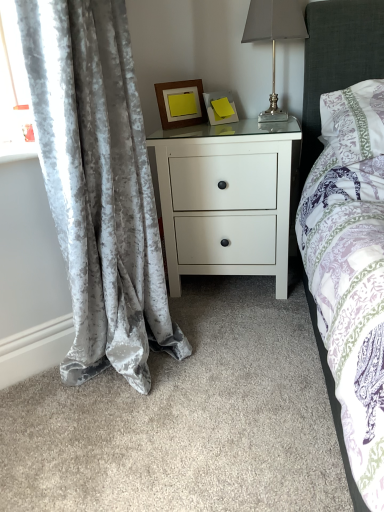
What do you see at coordinates (99, 185) in the screenshot? The image size is (384, 512). I see `velvet gray curtain at left` at bounding box center [99, 185].

Where is `matte yellow picture frame at upper center, the 2th picture frame in the left-to-right sequence`? matte yellow picture frame at upper center, the 2th picture frame in the left-to-right sequence is located at coordinates (220, 108).

Describe the element at coordinates (274, 38) in the screenshot. The image size is (384, 512). I see `metallic silver table lamp at upper right` at that location.

I want to click on velvet gray curtain at left, so click(x=99, y=185).

Is metallic silver table lamp at upper right positioned before wooden frame at upper center, the 2th picture frame in the right-to-left sequence?

Yes, metallic silver table lamp at upper right is in front of wooden frame at upper center, the 2th picture frame in the right-to-left sequence.

Is metallic silver table lamp at upper right inside the boundaries of wooden frame at upper center, the 2th picture frame in the right-to-left sequence, or outside?

metallic silver table lamp at upper right lies outside wooden frame at upper center, the 2th picture frame in the right-to-left sequence.

From a real-world perspective, between metallic silver table lamp at upper right and wooden frame at upper center, the 2th picture frame in the right-to-left sequence, who is vertically lower?

wooden frame at upper center, the 2th picture frame in the right-to-left sequence, from a real-world perspective.

Is metallic silver table lamp at upper right wider than wooden frame at upper center, the 2th picture frame in the right-to-left sequence?

Yes, metallic silver table lamp at upper right is wider than wooden frame at upper center, the 2th picture frame in the right-to-left sequence.

Is white floral fabric pillow at upper right not within metallic silver table lamp at upper right?

white floral fabric pillow at upper right is positioned outside metallic silver table lamp at upper right.

Locate an element on the screen. table lamp lying on the left of white floral fabric pillow at upper right is located at coordinates (274, 38).

Between white floral fabric pillow at upper right and metallic silver table lamp at upper right, which one appears on the left side from the viewer's perspective?

metallic silver table lamp at upper right.

Based on the photo, is velvet gray curtain at left completely or partially outside of metallic silver table lamp at upper right?

velvet gray curtain at left lies outside metallic silver table lamp at upper right's area.

Considering the positions of objects velvet gray curtain at left and metallic silver table lamp at upper right in the image provided, who is more to the right, velvet gray curtain at left or metallic silver table lamp at upper right?

metallic silver table lamp at upper right is more to the right.

Is point (81, 66) closer or farther from the camera than point (260, 118)?

Clearly, point (81, 66) is closer to the camera than point (260, 118).

Which of these two, velvet gray curtain at left or metallic silver table lamp at upper right, is thinner?

With smaller width is metallic silver table lamp at upper right.

Do you think white matte nightstand at center is within white floral fabric pillow at upper right, or outside of it?

white matte nightstand at center is not enclosed by white floral fabric pillow at upper right.

Is the position of white matte nightstand at center less distant than that of white floral fabric pillow at upper right?

No, white matte nightstand at center is further to the viewer.

Is white matte nightstand at center oriented away from white floral fabric pillow at upper right?

No, white matte nightstand at center's orientation is not away from white floral fabric pillow at upper right.

How different are the orientations of wooden frame at upper center, marked as the first picture frame in a left-to-right arrangement, and metallic silver table lamp at upper right in degrees?

44.5 degrees.

Who is smaller, wooden frame at upper center, marked as the first picture frame in a left-to-right arrangement, or metallic silver table lamp at upper right?

With smaller size is wooden frame at upper center, marked as the first picture frame in a left-to-right arrangement.

The image size is (384, 512). Find the location of `picture frame that is the 2nd object to the left of the metallic silver table lamp at upper right, starting at the anchor`. picture frame that is the 2nd object to the left of the metallic silver table lamp at upper right, starting at the anchor is located at coordinates (181, 103).

What are the coordinates of `picture frame that is the 2nd one when counting backward from the metallic silver table lamp at upper right` in the screenshot? It's located at click(220, 108).

Is metallic silver table lamp at upper right at the right side of matte yellow picture frame at upper center, placed as the 1th picture frame when sorted from right to left?

Yes, metallic silver table lamp at upper right is to the right of matte yellow picture frame at upper center, placed as the 1th picture frame when sorted from right to left.

Considering the sizes of metallic silver table lamp at upper right and matte yellow picture frame at upper center, placed as the 1th picture frame when sorted from right to left, in the image, is metallic silver table lamp at upper right wider or thinner than matte yellow picture frame at upper center, placed as the 1th picture frame when sorted from right to left,?

In the image, metallic silver table lamp at upper right appears to be wider than matte yellow picture frame at upper center, placed as the 1th picture frame when sorted from right to left.

Between white matte nightstand at center and matte yellow picture frame at upper center, placed as the 1th picture frame when sorted from right to left, which one has smaller width?

Thinner between the two is matte yellow picture frame at upper center, placed as the 1th picture frame when sorted from right to left.

In the image, is white matte nightstand at center positioned in front of or behind matte yellow picture frame at upper center, the 2th picture frame in the left-to-right sequence?

white matte nightstand at center is positioned closer to the viewer than matte yellow picture frame at upper center, the 2th picture frame in the left-to-right sequence.

From a real-world perspective, which object rests below the other?

white matte nightstand at center, from a real-world perspective.

Image resolution: width=384 pixels, height=512 pixels. Find the location of `nightstand that is on the right side of matte yellow picture frame at upper center, the 2th picture frame in the left-to-right sequence`. nightstand that is on the right side of matte yellow picture frame at upper center, the 2th picture frame in the left-to-right sequence is located at coordinates (226, 198).

Where is `picture frame that is the 1st one when counting downward from the metallic silver table lamp at upper right (from the image's perspective)`? This screenshot has height=512, width=384. picture frame that is the 1st one when counting downward from the metallic silver table lamp at upper right (from the image's perspective) is located at coordinates (181, 103).

Identify the location of pillow on the right side of metallic silver table lamp at upper right. This screenshot has width=384, height=512. [x=355, y=121].

Considering their positions, is wooden frame at upper center, marked as the first picture frame in a left-to-right arrangement, positioned further to metallic silver table lamp at upper right than white floral fabric pillow at upper right?

wooden frame at upper center, marked as the first picture frame in a left-to-right arrangement.

Estimate the real-world distances between objects in this image. Which object is further from white matte nightstand at center, wooden frame at upper center, marked as the first picture frame in a left-to-right arrangement, or white floral fabric pillow at upper right?

wooden frame at upper center, marked as the first picture frame in a left-to-right arrangement, is positioned further to the anchor white matte nightstand at center.

Looking at the image, which one is located further to wooden frame at upper center, marked as the first picture frame in a left-to-right arrangement, white matte nightstand at center or metallic silver table lamp at upper right?

Based on the image, white matte nightstand at center appears to be further to wooden frame at upper center, marked as the first picture frame in a left-to-right arrangement.

From the image, which object appears to be farther from metallic silver table lamp at upper right, white matte nightstand at center or wooden frame at upper center, the 2th picture frame in the right-to-left sequence?

white matte nightstand at center is positioned further to the anchor metallic silver table lamp at upper right.

Based on their spatial positions, is white floral fabric pillow at upper right or metallic silver table lamp at upper right closer to white matte nightstand at center?

white floral fabric pillow at upper right is closer to white matte nightstand at center.

Estimate the real-world distances between objects in this image. Which object is closer to matte yellow picture frame at upper center, the 2th picture frame in the left-to-right sequence, wooden frame at upper center, marked as the first picture frame in a left-to-right arrangement, or metallic silver table lamp at upper right?

Among the two, wooden frame at upper center, marked as the first picture frame in a left-to-right arrangement, is located nearer to matte yellow picture frame at upper center, the 2th picture frame in the left-to-right sequence.

Based on their spatial positions, is velvet gray curtain at left or wooden frame at upper center, the 2th picture frame in the right-to-left sequence, further from white matte nightstand at center?

Based on the image, velvet gray curtain at left appears to be further to white matte nightstand at center.

Estimate the real-world distances between objects in this image. Which object is further from wooden frame at upper center, the 2th picture frame in the right-to-left sequence, white floral fabric pillow at upper right or metallic silver table lamp at upper right?

Among the two, white floral fabric pillow at upper right is located further to wooden frame at upper center, the 2th picture frame in the right-to-left sequence.

Where is `picture frame between wooden frame at upper center, the 2th picture frame in the right-to-left sequence, and metallic silver table lamp at upper right`? The width and height of the screenshot is (384, 512). picture frame between wooden frame at upper center, the 2th picture frame in the right-to-left sequence, and metallic silver table lamp at upper right is located at coordinates click(x=220, y=108).

You are a GUI agent. You are given a task and a screenshot of the screen. Output one action in this format:
    pyautogui.click(x=<x>, y=<y>)
    Task: Click on the picture frame between wooden frame at upper center, marked as the first picture frame in a left-to-right arrangement, and white matte nightstand at center vertically
    
    Given the screenshot: What is the action you would take?
    pyautogui.click(x=220, y=108)

At what (x,y) coordinates should I click in order to perform the action: click on table lamp located between wooden frame at upper center, marked as the first picture frame in a left-to-right arrangement, and white floral fabric pillow at upper right in the left-right direction. Please return your answer as a coordinate pair (x, y). Looking at the image, I should click on pos(274,38).

Where is `nightstand between velvet gray curtain at left and wooden frame at upper center, the 2th picture frame in the right-to-left sequence, along the z-axis`? nightstand between velvet gray curtain at left and wooden frame at upper center, the 2th picture frame in the right-to-left sequence, along the z-axis is located at coordinates pos(226,198).